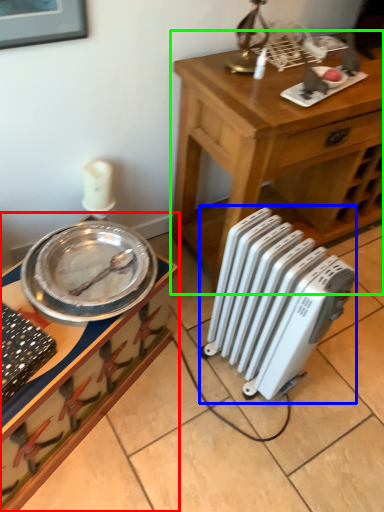
Question: Which is farther away from desk (highlighted by a red box)? radiator (highlighted by a blue box) or table (highlighted by a green box)?

Choices:
 (A) radiator
 (B) table

Answer: (B)